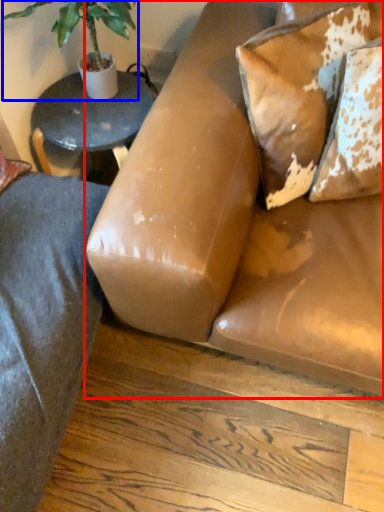
Question: Which object is further to the camera taking this photo, studio couch (highlighted by a red box) or houseplant (highlighted by a blue box)?

Choices:
 (A) studio couch
 (B) houseplant

Answer: (B)